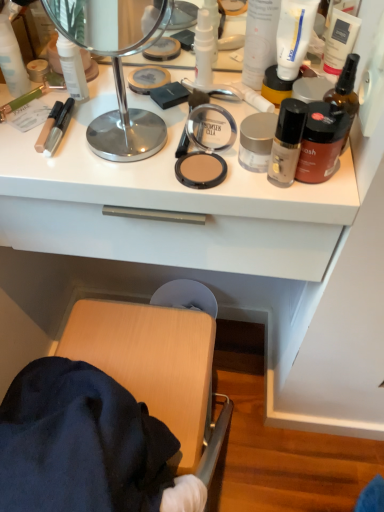
Find the location of a particular element. The image size is (384, 512). free space that is in between matte black concealer at left, which ranks as the ninth toiletry in right-to-left order, and white matte spray bottle at center, which appears as the third toiletry when viewed from the left is located at coordinates (113, 110).